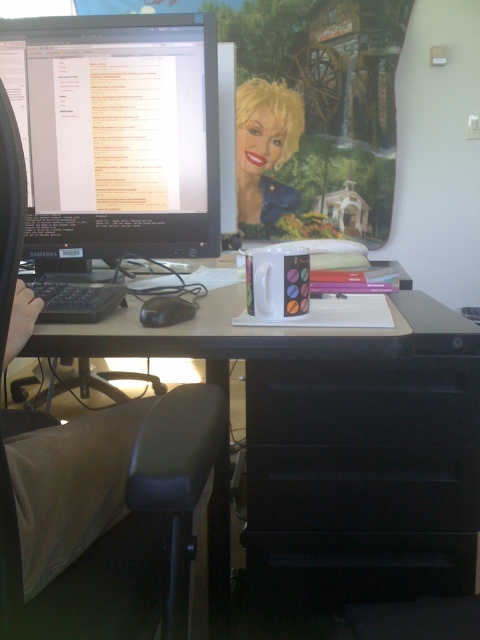
Question: Can you confirm if black glossy monitor at upper left is wider than black matte computer desk at center?

Choices:
 (A) yes
 (B) no

Answer: (B)

Question: Does black matte file cabinet at lower right have a larger size compared to black plastic keyboard at left?

Choices:
 (A) no
 (B) yes

Answer: (B)

Question: Which object is positioned closest to the matte plastic mug at center?

Choices:
 (A) black plastic keyboard at left
 (B) black matte computer desk at center
 (C) black glossy monitor at upper left
 (D) black matte file cabinet at lower right

Answer: (C)

Question: Estimate the real-world distances between objects in this image. Which object is farther from the black glossy monitor at upper left?

Choices:
 (A) matte plastic mug at center
 (B) black matte file cabinet at lower right

Answer: (A)

Question: Is black matte file cabinet at lower right to the left of black plastic keyboard at left from the viewer's perspective?

Choices:
 (A) no
 (B) yes

Answer: (A)

Question: Which of the following is the closest to the observer?

Choices:
 (A) (285, 381)
 (B) (255, 172)

Answer: (A)